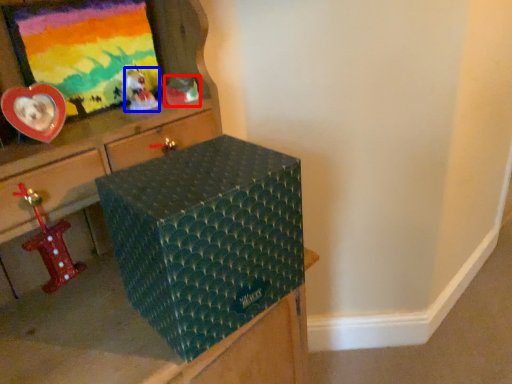
Question: Which point is further to the camera, toy (highlighted by a red box) or toy (highlighted by a blue box)?

Choices:
 (A) toy
 (B) toy

Answer: (A)